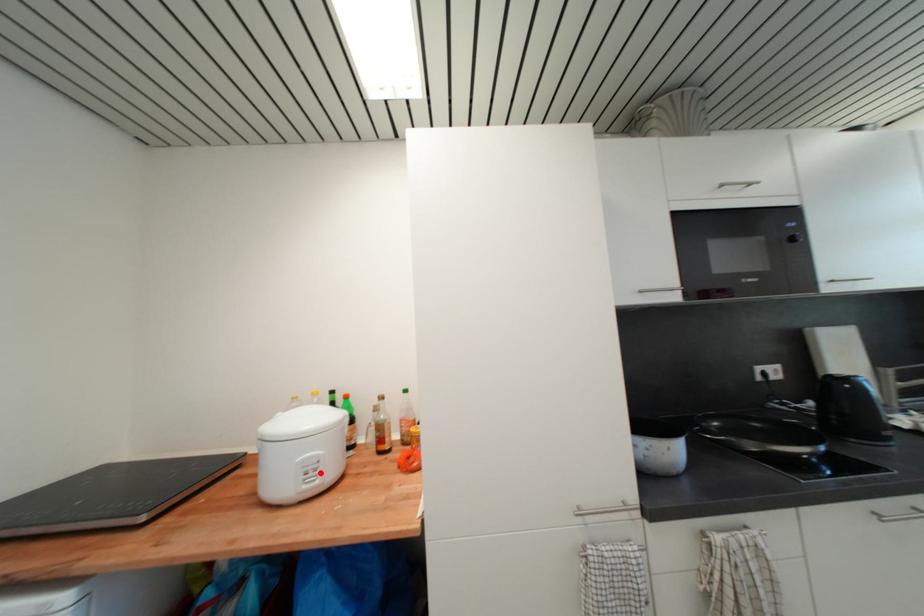
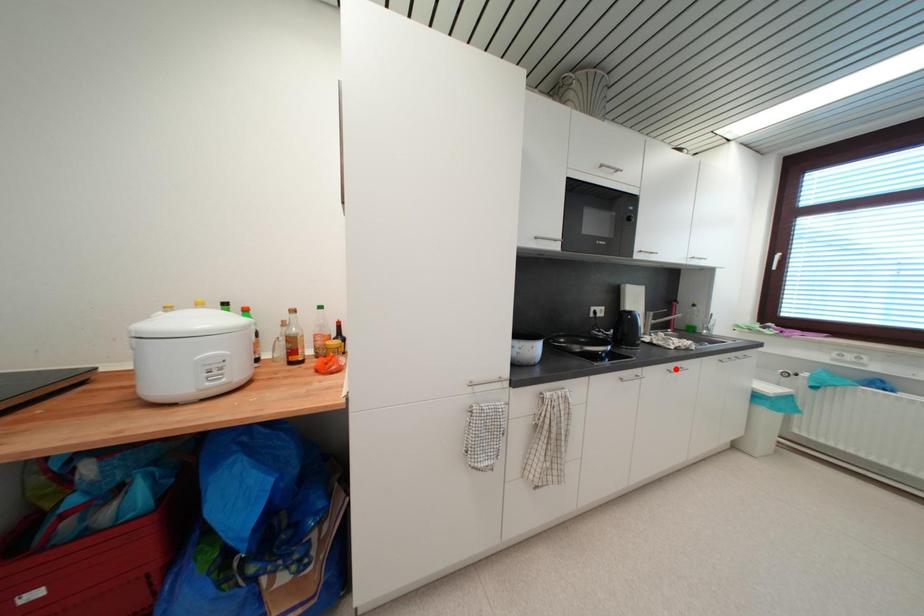
I am providing you with two images of the same scene from different viewpoints. A red point is marked on the first image and another point is marked on the second image. Is the red point in image1 aligned with the point shown in image2?

No